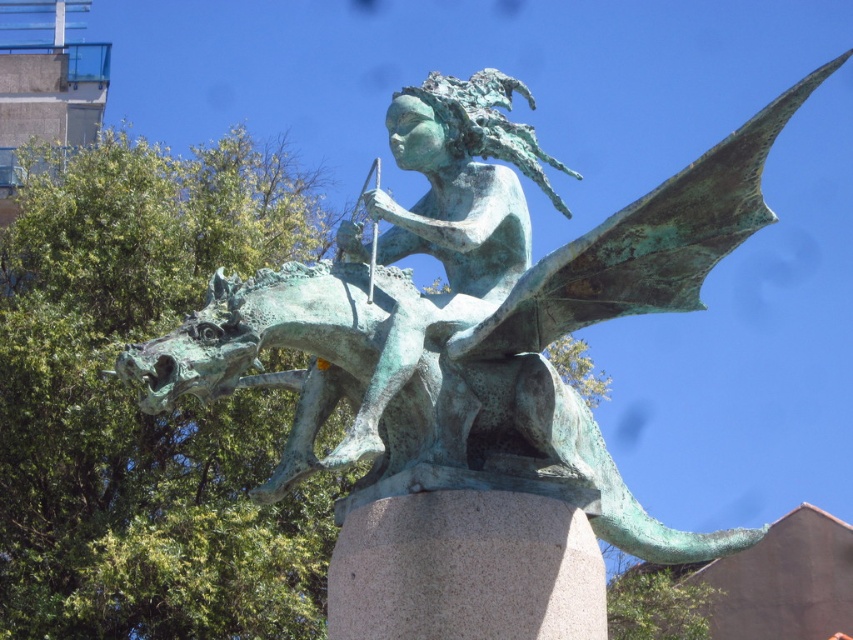
You are an art student analyzing the statue. You notice two objects labeled green patina dragon at center and green patina statue at center. Which one is located to the right of the other?

The green patina dragon at center is positioned on the right side of green patina statue at center.